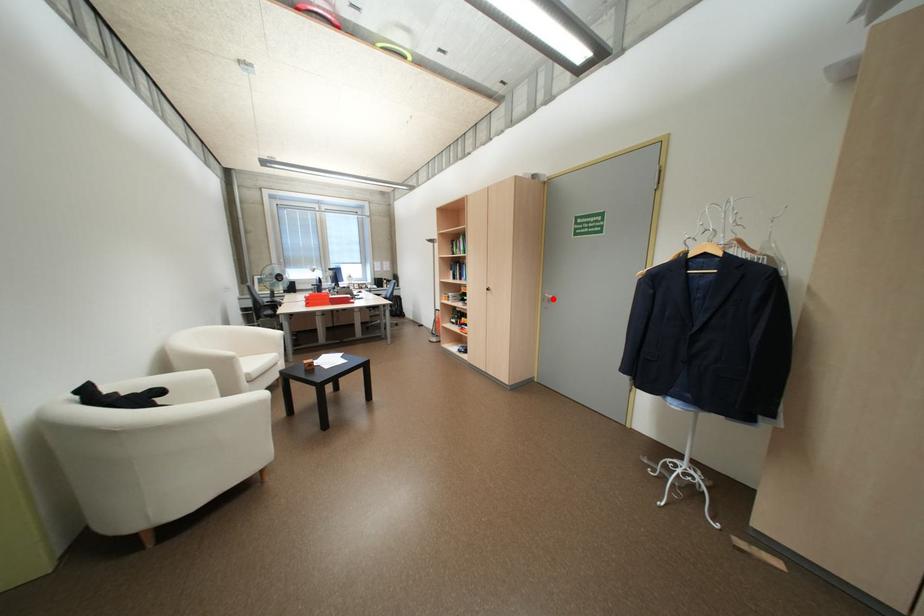
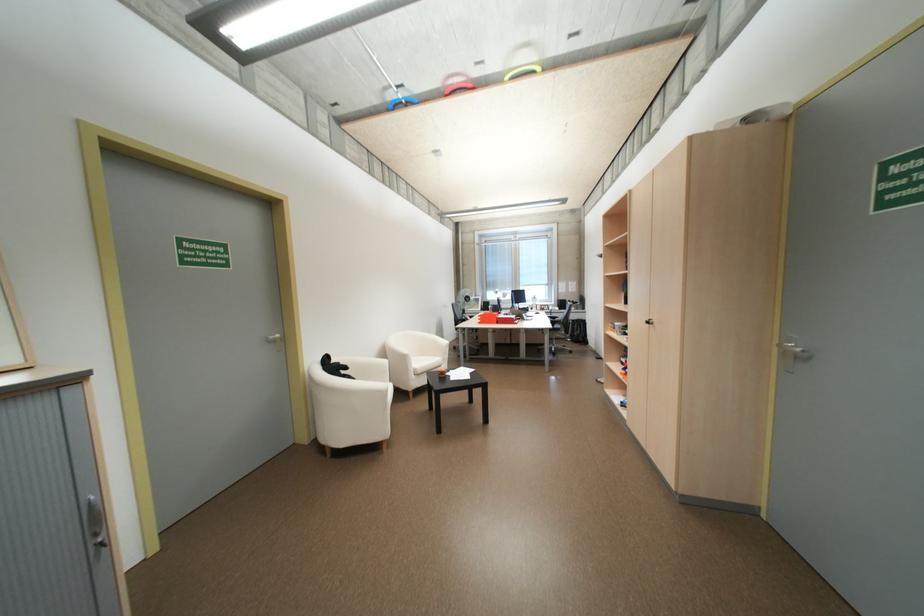
Where in the second image is the point corresponding to the highlighted location from the first image?

(795, 353)